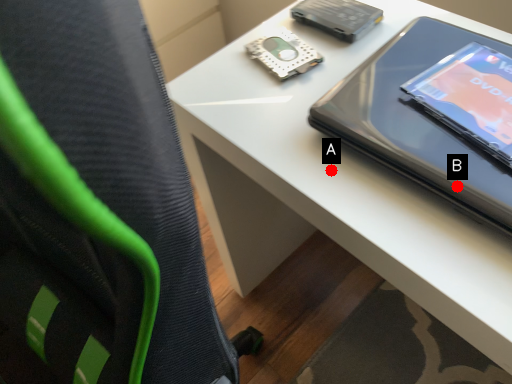
Question: Two points are circled on the image, labeled by A and B beside each circle. Among these points, which one is farthest from the camera?

Choices:
 (A) A is further
 (B) B is further

Answer: (A)